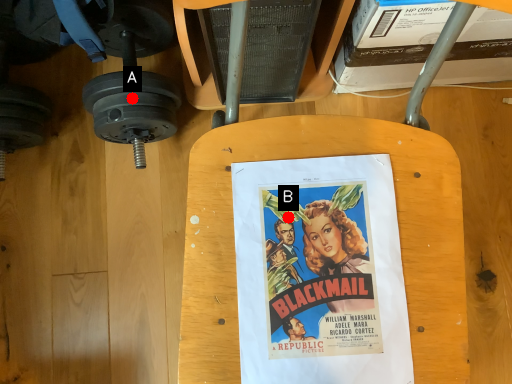
Question: Two points are circled on the image, labeled by A and B beside each circle. Which point appears farthest from the camera in this image?

Choices:
 (A) A is further
 (B) B is further

Answer: (A)